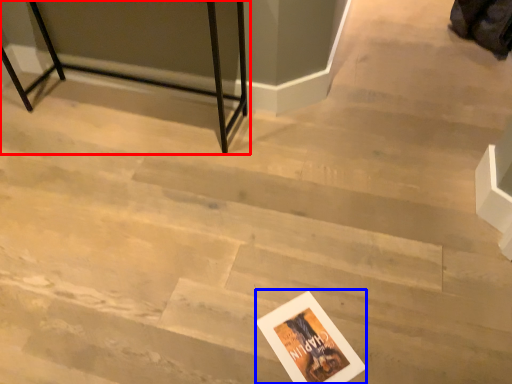
Question: Which point is further to the camera, furniture (highlighted by a red box) or postcard (highlighted by a blue box)?

Choices:
 (A) furniture
 (B) postcard

Answer: (A)